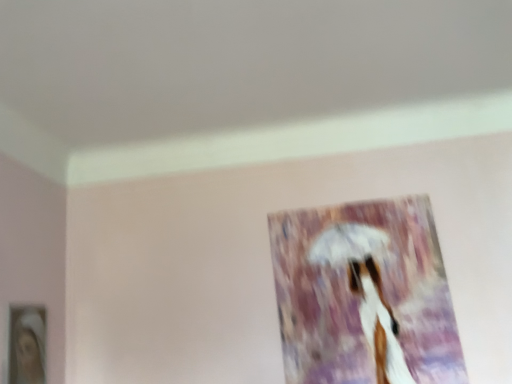
What do you see at coordinates (364, 295) in the screenshot?
I see `matte glass picture frame at center, which appears as the 2th picture frame when viewed from the front` at bounding box center [364, 295].

The image size is (512, 384). I want to click on matte glass picture frame at center, positioned as the first picture frame in right-to-left order, so click(x=364, y=295).

Measure the distance between point (286, 357) and camera.

Point (286, 357) and camera are 4.93 feet apart.

This screenshot has height=384, width=512. I want to click on matte white picture frame at lower left, which is counted as the 2th picture frame, starting from the right, so click(27, 345).

Image resolution: width=512 pixels, height=384 pixels. What do you see at coordinates (27, 345) in the screenshot? I see `matte white picture frame at lower left, which is counted as the 2th picture frame, starting from the right` at bounding box center [27, 345].

Where is `matte glass picture frame at center, which appears as the 2th picture frame when viewed from the front`? This screenshot has height=384, width=512. matte glass picture frame at center, which appears as the 2th picture frame when viewed from the front is located at coordinates (364, 295).

Based on the photo, which object is positioned more to the left, matte glass picture frame at center, the second picture frame positioned from the left, or matte white picture frame at lower left, which is the 1th picture frame from front to back?

Positioned to the left is matte white picture frame at lower left, which is the 1th picture frame from front to back.

Between matte glass picture frame at center, positioned as the first picture frame in right-to-left order, and matte white picture frame at lower left, which is counted as the 2th picture frame, starting from the right, which one is positioned in front?

matte white picture frame at lower left, which is counted as the 2th picture frame, starting from the right, is more forward.

Looking at this image, which is closer, (332, 294) or (13, 382)?

Point (332, 294) appears to be farther away from the viewer than point (13, 382).

From the image's perspective, which one is positioned higher, matte glass picture frame at center, positioned as the first picture frame in right-to-left order, or matte white picture frame at lower left, which appears as the 1th picture frame when viewed from the left?

matte glass picture frame at center, positioned as the first picture frame in right-to-left order, appears higher in the image.

From a real-world perspective, is matte glass picture frame at center, positioned as the first picture frame in right-to-left order, above or below matte white picture frame at lower left, which is the 1th picture frame from front to back?

From a real-world perspective, matte glass picture frame at center, positioned as the first picture frame in right-to-left order, is physically above matte white picture frame at lower left, which is the 1th picture frame from front to back.

Between matte glass picture frame at center, positioned as the first picture frame in right-to-left order, and matte white picture frame at lower left, which is counted as the 2th picture frame, starting from the right, which one has larger width?

Wider between the two is matte white picture frame at lower left, which is counted as the 2th picture frame, starting from the right.

Who is shorter, matte glass picture frame at center, acting as the 1th picture frame starting from the back, or matte white picture frame at lower left, the 2th picture frame when ordered from back to front?

With less height is matte white picture frame at lower left, the 2th picture frame when ordered from back to front.

Is matte glass picture frame at center, acting as the 1th picture frame starting from the back, bigger or smaller than matte white picture frame at lower left, which is the 1th picture frame from front to back?

In the image, matte glass picture frame at center, acting as the 1th picture frame starting from the back, appears to be larger than matte white picture frame at lower left, which is the 1th picture frame from front to back.

Is matte glass picture frame at center, which appears as the 2th picture frame when viewed from the front, inside or outside of matte white picture frame at lower left, the 2th picture frame when ordered from back to front?

matte glass picture frame at center, which appears as the 2th picture frame when viewed from the front, is not inside matte white picture frame at lower left, the 2th picture frame when ordered from back to front, it's outside.

Is matte glass picture frame at center, acting as the 1th picture frame starting from the back, not near matte white picture frame at lower left, the 2th picture frame when ordered from back to front?

Yes.

Could you tell me if matte glass picture frame at center, acting as the 1th picture frame starting from the back, is facing matte white picture frame at lower left, which is counted as the 2th picture frame, starting from the right?

No, matte glass picture frame at center, acting as the 1th picture frame starting from the back, is not turned towards matte white picture frame at lower left, which is counted as the 2th picture frame, starting from the right.

What's the angular difference between matte glass picture frame at center, positioned as the first picture frame in right-to-left order, and matte white picture frame at lower left, which appears as the 1th picture frame when viewed from the left,'s facing directions?

92.3 degrees separate the facing orientations of matte glass picture frame at center, positioned as the first picture frame in right-to-left order, and matte white picture frame at lower left, which appears as the 1th picture frame when viewed from the left.

How much distance is there between matte glass picture frame at center, the second picture frame positioned from the left, and matte white picture frame at lower left, which is the 1th picture frame from front to back?

matte glass picture frame at center, the second picture frame positioned from the left, is 3.45 feet from matte white picture frame at lower left, which is the 1th picture frame from front to back.

This screenshot has height=384, width=512. I want to click on picture frame located behind the matte white picture frame at lower left, which is the 1th picture frame from front to back, so click(364, 295).

Consider the image. Which object is positioned more to the right, matte white picture frame at lower left, which is counted as the 2th picture frame, starting from the right, or matte glass picture frame at center, which appears as the 2th picture frame when viewed from the front?

Positioned to the right is matte glass picture frame at center, which appears as the 2th picture frame when viewed from the front.

Considering their positions, is matte white picture frame at lower left, the 2th picture frame when ordered from back to front, located in front of or behind matte glass picture frame at center, which appears as the 2th picture frame when viewed from the front?

In the image, matte white picture frame at lower left, the 2th picture frame when ordered from back to front, appears in front of matte glass picture frame at center, which appears as the 2th picture frame when viewed from the front.

Is point (12, 363) closer or farther from the camera than point (340, 212)?

Point (12, 363) appears to be closer to the viewer than point (340, 212).

From the image's perspective, is matte white picture frame at lower left, which appears as the 1th picture frame when viewed from the left, located above or below matte glass picture frame at center, positioned as the first picture frame in right-to-left order?

Based on their image positions, matte white picture frame at lower left, which appears as the 1th picture frame when viewed from the left, is located beneath matte glass picture frame at center, positioned as the first picture frame in right-to-left order.

From a real-world perspective, relative to matte glass picture frame at center, the second picture frame positioned from the left, is matte white picture frame at lower left, which appears as the 1th picture frame when viewed from the left, vertically above or below?

matte white picture frame at lower left, which appears as the 1th picture frame when viewed from the left, is situated lower than matte glass picture frame at center, the second picture frame positioned from the left, in the real world.

Is matte white picture frame at lower left, which is the 1th picture frame from front to back, thinner than matte glass picture frame at center, acting as the 1th picture frame starting from the back?

Incorrect, the width of matte white picture frame at lower left, which is the 1th picture frame from front to back, is not less than that of matte glass picture frame at center, acting as the 1th picture frame starting from the back.

Does matte white picture frame at lower left, which appears as the 1th picture frame when viewed from the left, have a greater height compared to matte glass picture frame at center, the second picture frame positioned from the left?

No.

Considering the sizes of objects matte white picture frame at lower left, the 2th picture frame when ordered from back to front, and matte glass picture frame at center, acting as the 1th picture frame starting from the back, in the image provided, who is smaller, matte white picture frame at lower left, the 2th picture frame when ordered from back to front, or matte glass picture frame at center, acting as the 1th picture frame starting from the back,?

Smaller between the two is matte white picture frame at lower left, the 2th picture frame when ordered from back to front.

Is matte white picture frame at lower left, which is the 1th picture frame from front to back, situated inside matte glass picture frame at center, the second picture frame positioned from the left, or outside?

matte white picture frame at lower left, which is the 1th picture frame from front to back, is spatially situated outside matte glass picture frame at center, the second picture frame positioned from the left.

Is matte white picture frame at lower left, which is the 1th picture frame from front to back, positioned far away from matte glass picture frame at center, acting as the 1th picture frame starting from the back?

Yes.

Is matte white picture frame at lower left, which is the 1th picture frame from front to back, aimed at matte glass picture frame at center, acting as the 1th picture frame starting from the back?

Yes, matte white picture frame at lower left, which is the 1th picture frame from front to back, is turned towards matte glass picture frame at center, acting as the 1th picture frame starting from the back.

From the picture: How much distance is there between matte white picture frame at lower left, which is counted as the 2th picture frame, starting from the right, and matte glass picture frame at center, which appears as the 2th picture frame when viewed from the front?

matte white picture frame at lower left, which is counted as the 2th picture frame, starting from the right, and matte glass picture frame at center, which appears as the 2th picture frame when viewed from the front, are 3.45 feet apart from each other.

Where is `picture frame above the matte white picture frame at lower left, which is the 1th picture frame from front to back (from the image's perspective)`? The image size is (512, 384). picture frame above the matte white picture frame at lower left, which is the 1th picture frame from front to back (from the image's perspective) is located at coordinates (364, 295).

In order to click on picture frame above the matte white picture frame at lower left, which is the 1th picture frame from front to back (from a real-world perspective) in this screenshot , I will do (364, 295).

Identify the location of picture frame directly beneath the matte glass picture frame at center, acting as the 1th picture frame starting from the back (from a real-world perspective). (27, 345).